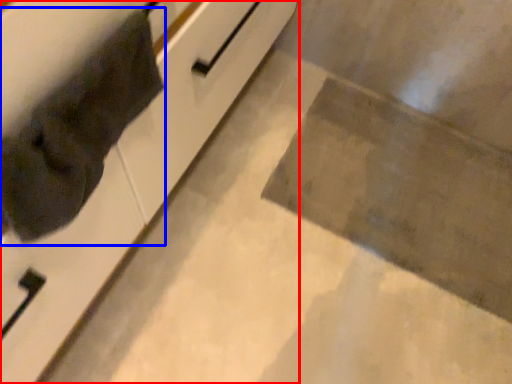
Question: Among these objects, which one is farthest to the camera, cabinetry (highlighted by a red box) or cat (highlighted by a blue box)?

Choices:
 (A) cabinetry
 (B) cat

Answer: (B)